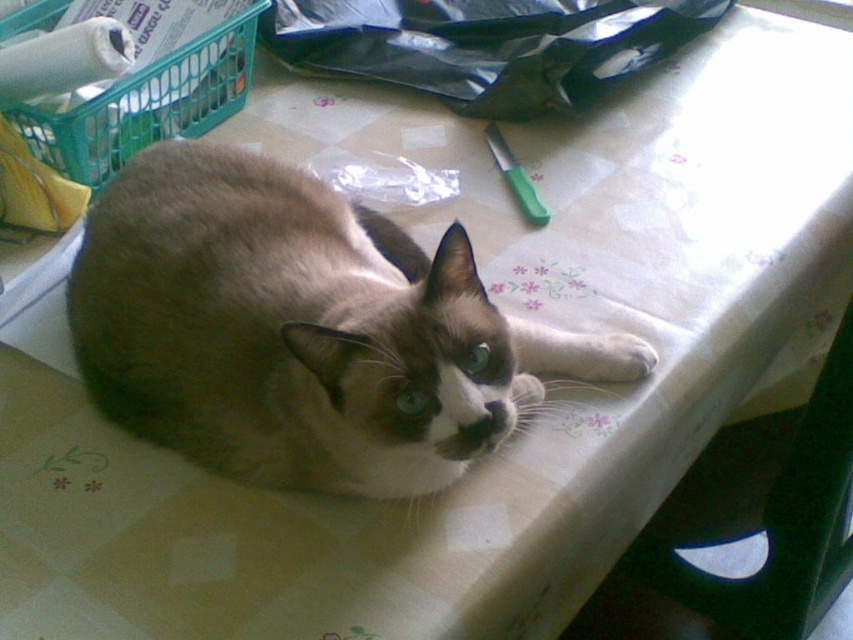
You are a photographer setting up a photo shoot. You need to position the silky fur cat at center so that it can comfortably sit on the green plastic chair at lower right. Based on their sizes, will the cat fit on the chair?

The silky fur cat at center is not as tall as the green plastic chair at lower right, so the cat should fit comfortably on the chair since it is shorter in height.

You are a visitor in a room and you see the silky fur cat at center and the green plastic chair at lower right. Which object is closer to you?

The silky fur cat at center is closer to the viewer than the green plastic chair at lower right.